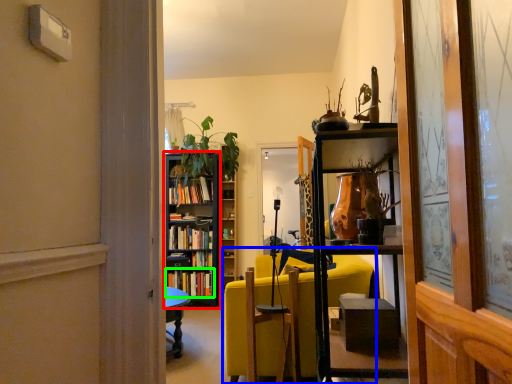
Question: Estimate the real-world distances between objects in this image. Which object is closer to bookcase (highlighted by a red box), studio couch (highlighted by a blue box) or book (highlighted by a green box)?

Choices:
 (A) studio couch
 (B) book

Answer: (B)